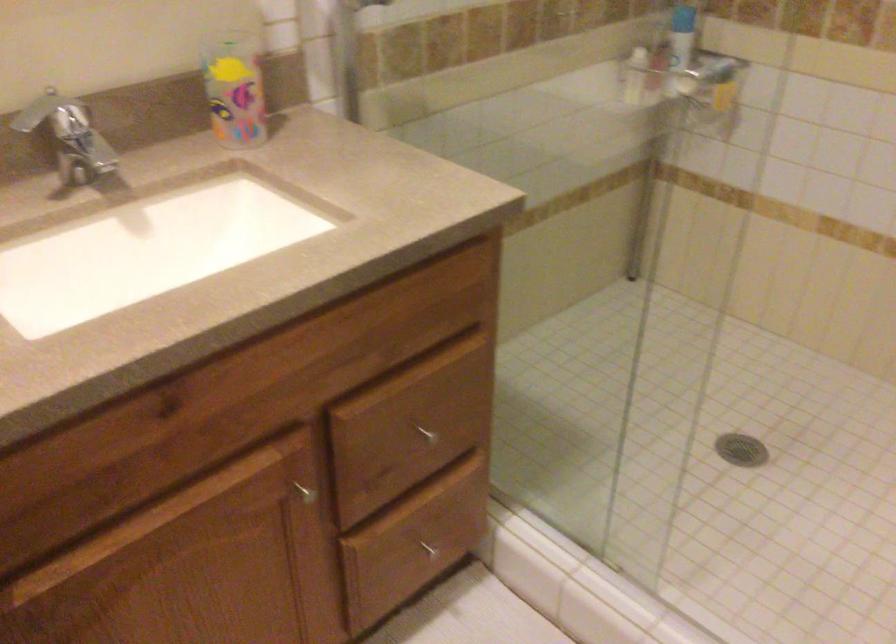
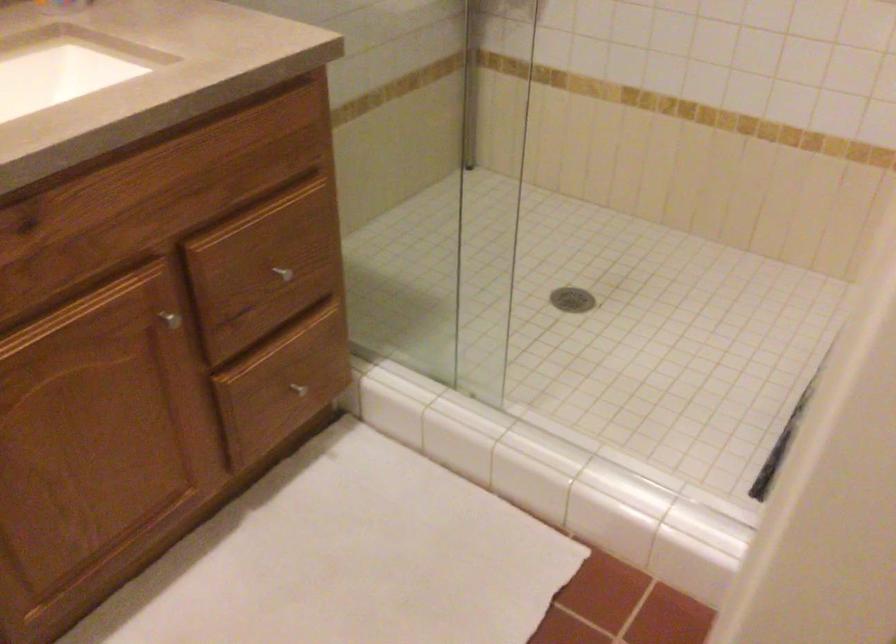
Question: The camera is either moving clockwise (left) or counter-clockwise (right) around the object. The first image is from the beginning of the video and the second image is from the end. Is the camera moving left or right when shooting the video?

Choices:
 (A) Left
 (B) Right

Answer: (A)